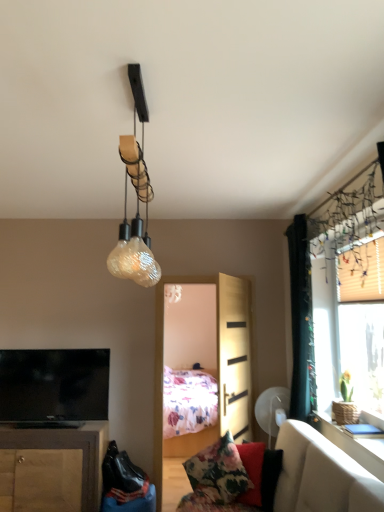
Question: Does floral fabric pillow at lower center have a greater height compared to black fabric curtain at right?

Choices:
 (A) yes
 (B) no

Answer: (B)

Question: Considering the relative sizes of floral fabric pillow at lower center and black fabric curtain at right in the image provided, is floral fabric pillow at lower center shorter than black fabric curtain at right?

Choices:
 (A) yes
 (B) no

Answer: (A)

Question: Is floral fabric pillow at lower center beside black fabric curtain at right?

Choices:
 (A) yes
 (B) no

Answer: (B)

Question: From the image's perspective, would you say floral fabric pillow at lower center is shown under black fabric curtain at right?

Choices:
 (A) yes
 (B) no

Answer: (A)

Question: Is black fabric curtain at right at the back of floral fabric pillow at lower center?

Choices:
 (A) no
 (B) yes

Answer: (A)

Question: Considering the positions of white glossy table at upper right and light wood screen door at center in the image, is white glossy table at upper right taller or shorter than light wood screen door at center?

Choices:
 (A) tall
 (B) short

Answer: (B)

Question: From the image's perspective, is white glossy table at upper right above or below light wood screen door at center?

Choices:
 (A) below
 (B) above

Answer: (A)

Question: Is white glossy table at upper right in front of or behind light wood screen door at center in the image?

Choices:
 (A) behind
 (B) front

Answer: (B)

Question: Is white glossy table at upper right bigger or smaller than light wood screen door at center?

Choices:
 (A) big
 (B) small

Answer: (B)

Question: Is floral fabric pillow at lower center bigger or smaller than black fabric curtain at right?

Choices:
 (A) big
 (B) small

Answer: (B)

Question: Is point (x=218, y=466) closer or farther from the camera than point (x=301, y=297)?

Choices:
 (A) closer
 (B) farther

Answer: (A)

Question: Relative to black fabric curtain at right, is floral fabric pillow at lower center in front or behind?

Choices:
 (A) front
 (B) behind

Answer: (A)

Question: Is floral fabric pillow at lower center to the left or to the right of black fabric curtain at right in the image?

Choices:
 (A) right
 (B) left

Answer: (B)

Question: Looking at the image, does velvet beige couch at lower right seem bigger or smaller compared to white glossy table at upper right?

Choices:
 (A) small
 (B) big

Answer: (B)

Question: Visually, is velvet beige couch at lower right positioned to the left or to the right of white glossy table at upper right?

Choices:
 (A) right
 (B) left

Answer: (B)